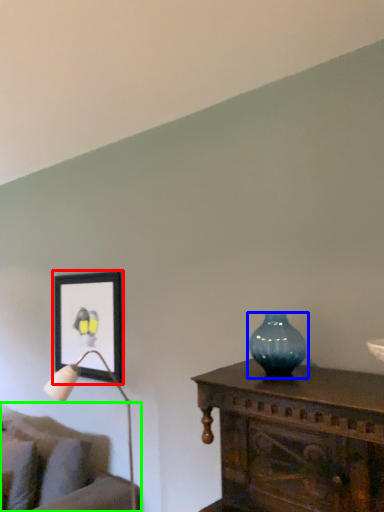
Question: Considering the real-world distances, which object is farthest from picture frame (highlighted by a red box)? vase (highlighted by a blue box) or studio couch (highlighted by a green box)?

Choices:
 (A) vase
 (B) studio couch

Answer: (A)